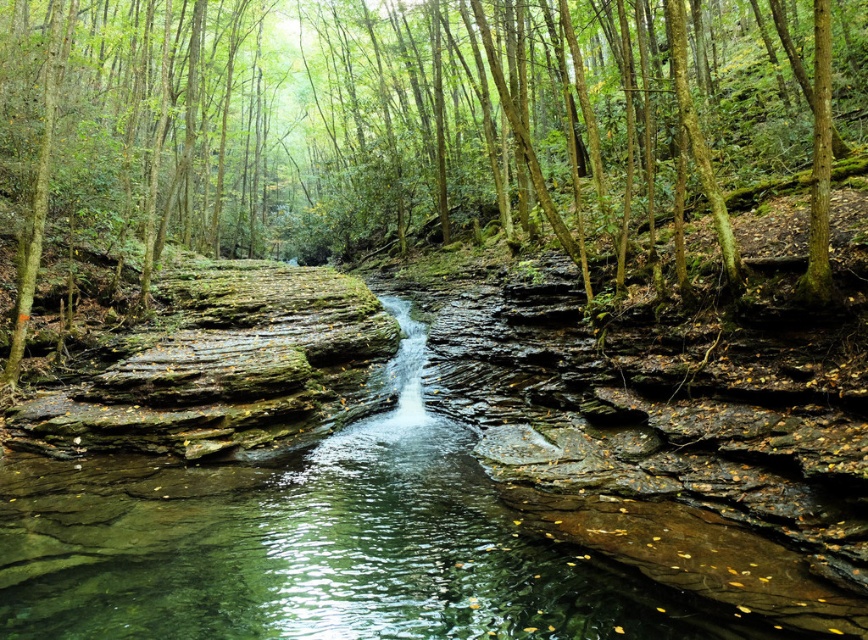
Question: Which object appears closest to the camera in this image?

Choices:
 (A) clear stone waterfall at center
 (B) green mossy rock at center

Answer: (A)

Question: Can you confirm if green mossy rock at center is bigger than clear stone waterfall at center?

Choices:
 (A) no
 (B) yes

Answer: (B)

Question: Can you confirm if green mossy rock at center is positioned above clear stone waterfall at center?

Choices:
 (A) no
 (B) yes

Answer: (B)

Question: Does green mossy rock at center have a larger size compared to clear stone waterfall at center?

Choices:
 (A) yes
 (B) no

Answer: (A)